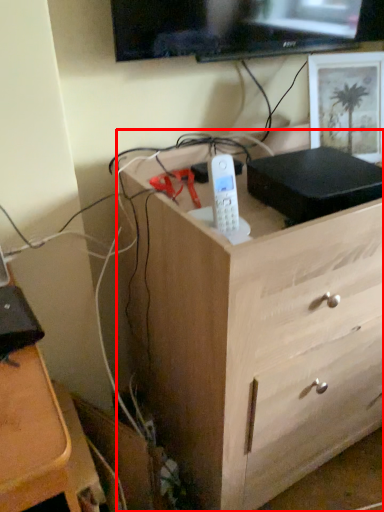
Question: From the image, what is the correct spatial relationship of chest of drawers (annotated by the red box) in relation to picture frame?

Choices:
 (A) right
 (B) left

Answer: (B)